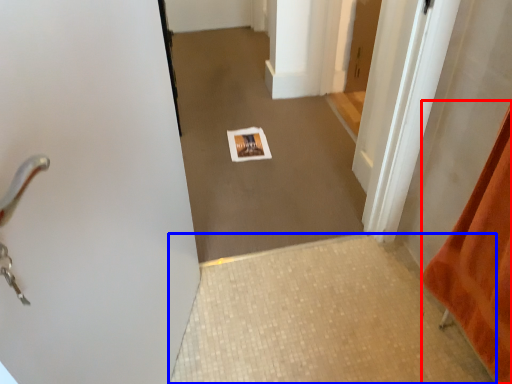
Question: Among these objects, which one is farthest to the camera, blanket (highlighted by a red box) or tile (highlighted by a blue box)?

Choices:
 (A) blanket
 (B) tile

Answer: (B)